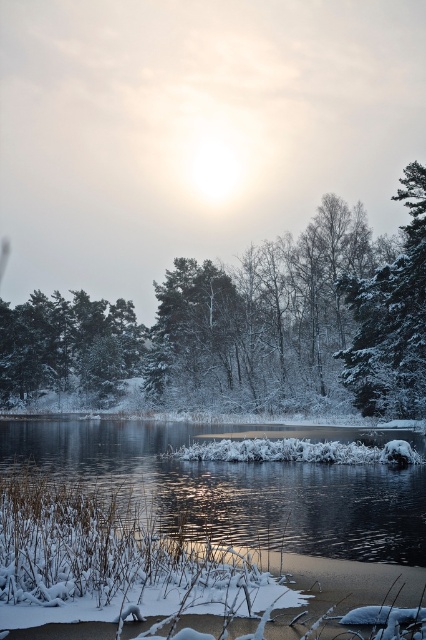
Question: Can you confirm if snow-covered evergreen tree at right is positioned below green matte tree at upper left?

Choices:
 (A) yes
 (B) no

Answer: (B)

Question: Which object is positioned closest to the clear ice water at lower center?

Choices:
 (A) green matte tree at upper left
 (B) snow-covered evergreen tree at right

Answer: (B)

Question: Which of the following is the closest to the observer?

Choices:
 (A) green matte tree at upper left
 (B) snow-covered evergreen tree at right
 (C) clear ice water at lower center

Answer: (C)

Question: Is clear ice water at lower center to the right of green matte tree at upper left from the viewer's perspective?

Choices:
 (A) no
 (B) yes

Answer: (B)

Question: Which of these objects is positioned farthest from the snow-covered evergreen tree at right?

Choices:
 (A) clear ice water at lower center
 (B) green matte tree at upper left

Answer: (B)

Question: Is clear ice water at lower center smaller than snow-covered evergreen tree at right?

Choices:
 (A) no
 (B) yes

Answer: (A)